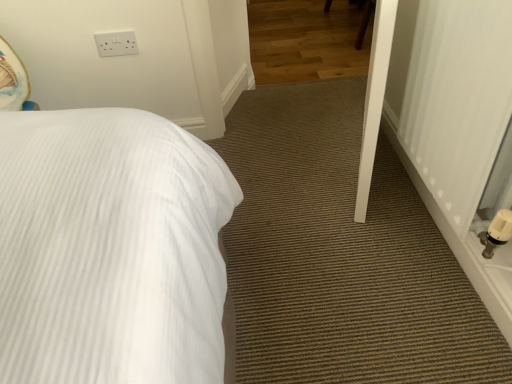
Question: Is point (429, 21) closer or farther from the camera than point (128, 33)?

Choices:
 (A) closer
 (B) farther

Answer: (A)

Question: From the image's perspective, is white plastic radiator at right positioned above or below white plastic electric outlet at upper left?

Choices:
 (A) above
 (B) below

Answer: (B)

Question: Is white plastic radiator at right to the left or to the right of white plastic electric outlet at upper left in the image?

Choices:
 (A) left
 (B) right

Answer: (B)

Question: Is white plastic electric outlet at upper left situated inside white plastic radiator at right or outside?

Choices:
 (A) inside
 (B) outside

Answer: (B)

Question: From their relative heights in the image, would you say white plastic electric outlet at upper left is taller or shorter than white plastic radiator at right?

Choices:
 (A) short
 (B) tall

Answer: (A)

Question: From the image's perspective, is white plastic electric outlet at upper left above or below white plastic radiator at right?

Choices:
 (A) above
 (B) below

Answer: (A)

Question: In terms of size, does white plastic electric outlet at upper left appear bigger or smaller than white plastic radiator at right?

Choices:
 (A) big
 (B) small

Answer: (B)